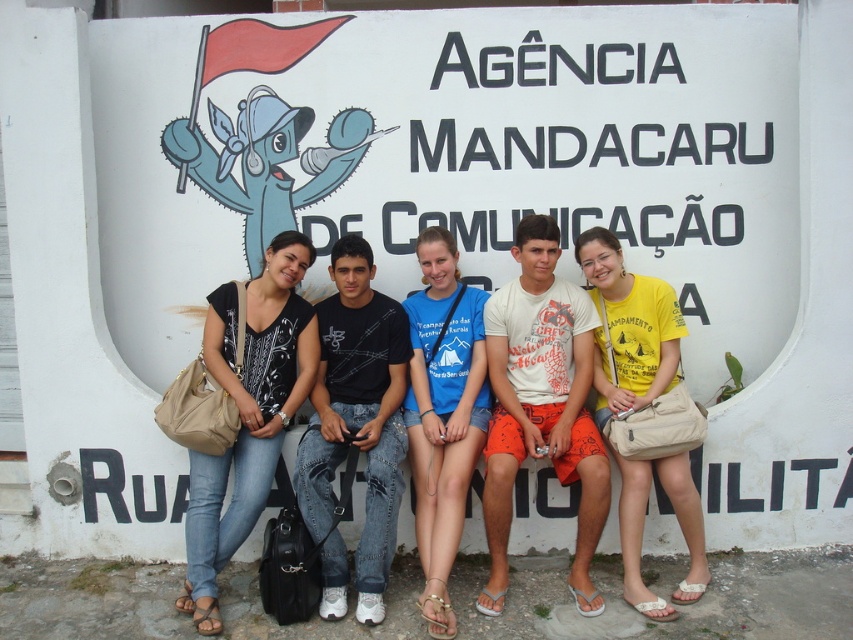
Question: Does black cotton shirt at center appear over yellow cotton shirt at center?

Choices:
 (A) yes
 (B) no

Answer: (B)

Question: Which point appears farthest from the camera in this image?

Choices:
 (A) (325, 465)
 (B) (592, 612)
 (C) (437, 541)

Answer: (A)

Question: Does orange cotton shorts at center lie in front of black cotton shirt at center?

Choices:
 (A) no
 (B) yes

Answer: (A)

Question: Which of the following is the closest to the observer?

Choices:
 (A) (467, 458)
 (B) (538, 342)
 (C) (640, 604)

Answer: (C)

Question: Is orange cotton shorts at center above blue cotton t-shirt at center?

Choices:
 (A) yes
 (B) no

Answer: (A)

Question: Which object is farther from the camera taking this photo?

Choices:
 (A) yellow cotton shirt at center
 (B) black cotton shirt at center
 (C) black printed blouse at left
 (D) blue cotton t-shirt at center

Answer: (A)